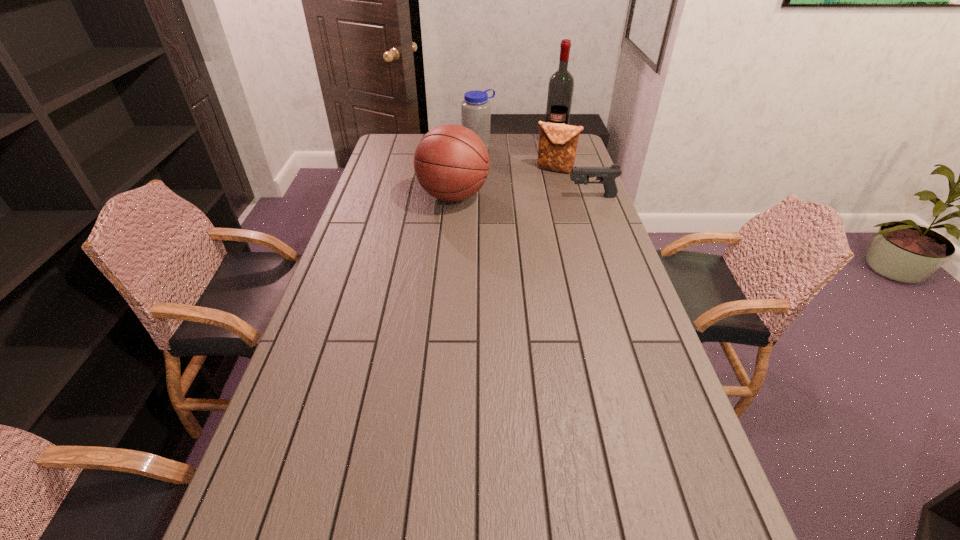
At what (x,y) coordinates should I click in order to perform the action: click on vacant space located 0.100m on the open side of the fourth tallest object. Please return your answer as a coordinate pair (x, y). The image size is (960, 540). Looking at the image, I should click on (540, 185).

Locate an element on the screen. This screenshot has height=540, width=960. vacant space situated 0.050m on the open side of the fourth tallest object is located at coordinates (544, 180).

You are a GUI agent. You are given a task and a screenshot of the screen. Output one action in this format:
    pyautogui.click(x=<x>, y=<y>)
    Task: Click on the vacant position located on the open side of the fourth tallest object
    The height and width of the screenshot is (540, 960).
    Given the screenshot: What is the action you would take?
    (x=540, y=184)

Locate an element on the screen. free space located on the front and back of the tallest object is located at coordinates (542, 176).

This screenshot has width=960, height=540. Identify the location of free space located on the front and back of the tallest object. (540, 184).

Where is `vacant space located on the front and back of the tallest object`? The image size is (960, 540). vacant space located on the front and back of the tallest object is located at coordinates (549, 157).

The width and height of the screenshot is (960, 540). What are the coordinates of `vacant space located 0.190m with a carrying loop on the side of the water bottle` in the screenshot? It's located at (508, 172).

In order to click on vacant space located with a carrying loop on the side of the water bottle in this screenshot , I will do `click(525, 185)`.

The width and height of the screenshot is (960, 540). I want to click on vacant area situated with a carrying loop on the side of the water bottle, so point(495,161).

At what (x,y) coordinates should I click in order to perform the action: click on alcohol situated at the far edge. Please return your answer as a coordinate pair (x, y). The width and height of the screenshot is (960, 540). Looking at the image, I should click on (561, 84).